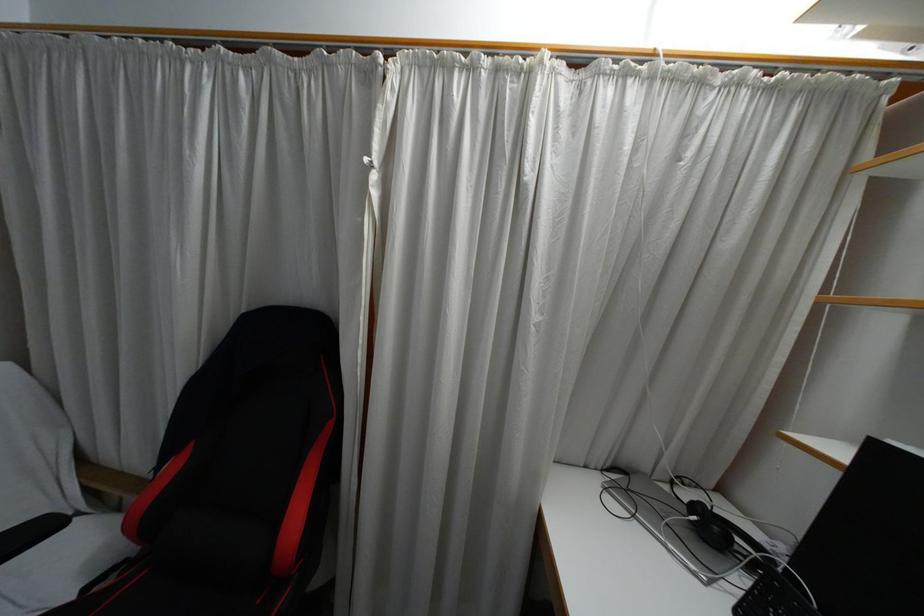
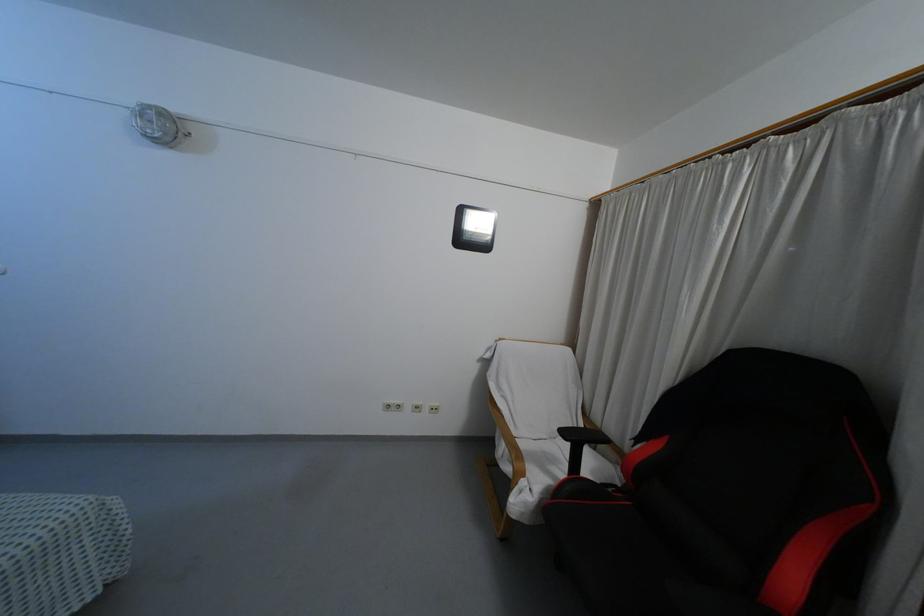
Question: The images are taken continuously from a first-person perspective. In which direction is your viewpoint rotating?

Choices:
 (A) Left
 (B) Right
 (C) Up
 (D) Down

Answer: (A)